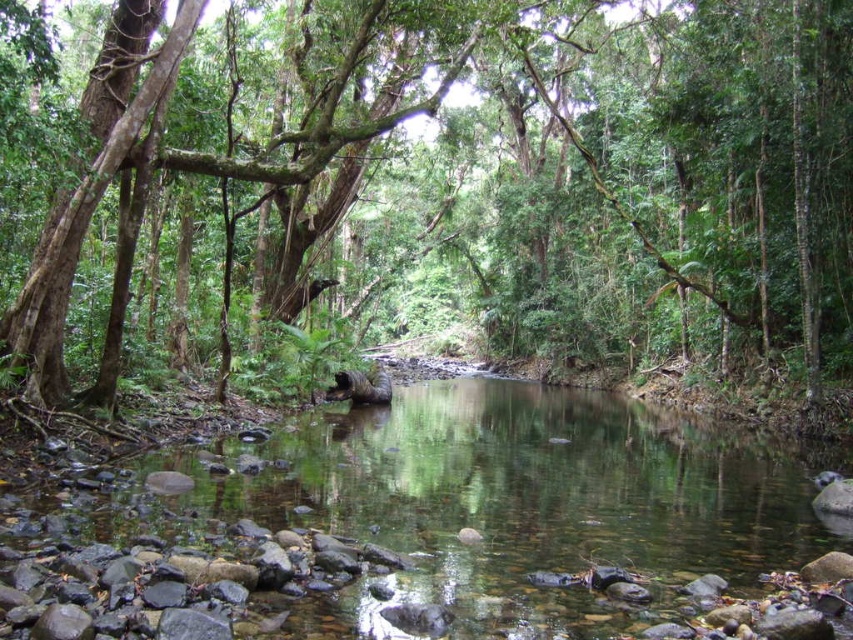
Between green leafy tree at center and clear water stream at center, which one has more height?

green leafy tree at center

Describe the element at coordinates (482, 177) in the screenshot. I see `green leafy tree at center` at that location.

Find the location of a particular element. The height and width of the screenshot is (640, 853). green leafy tree at center is located at coordinates (482, 177).